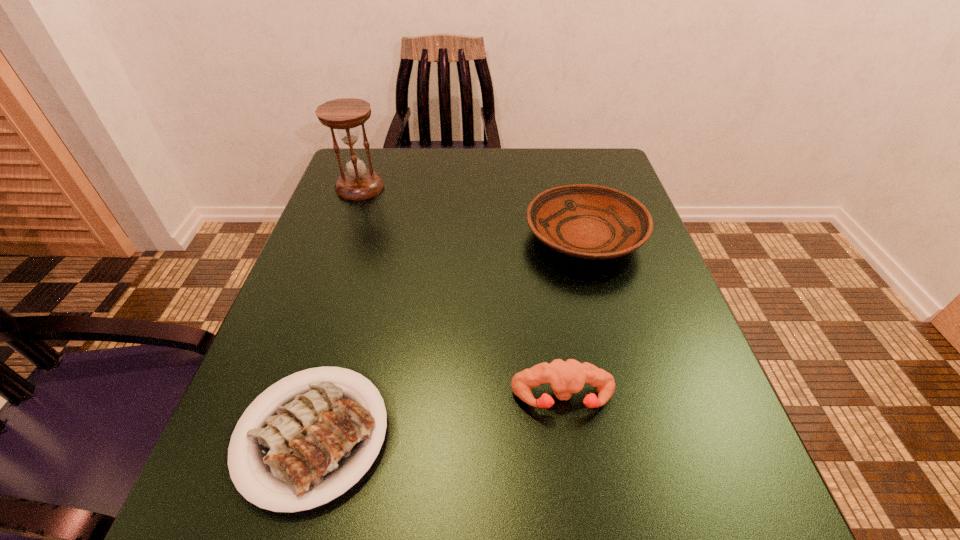
I want to click on free space between the taller plate and the puncher, so click(573, 318).

This screenshot has width=960, height=540. I want to click on empty space between the third nearest object and the puncher, so click(x=573, y=318).

Identify the location of free area in between the left plate and the puncher. This screenshot has width=960, height=540. tap(438, 417).

This screenshot has width=960, height=540. What are the coordinates of `free space that is in between the hourglass and the third nearest object` in the screenshot? It's located at (472, 212).

The image size is (960, 540). Find the location of `free space that is in between the nearer plate and the hourglass`. free space that is in between the nearer plate and the hourglass is located at coordinates (337, 311).

Locate which object is the closest to the nearer plate. Please provide its 2D coordinates. Your answer should be formatted as a tuple, i.e. [(x, y)], where the tuple contains the x and y coordinates of a point satisfying the conditions above.

[(566, 377)]

Choose which object is the third nearest neighbor to the puncher. Please provide its 2D coordinates. Your answer should be formatted as a tuple, i.e. [(x, y)], where the tuple contains the x and y coordinates of a point satisfying the conditions above.

[(345, 115)]

Identify the location of free space that satisfies the following two spatial constraints: 1. on the front side of the tallest object; 2. on the left side of the farther plate. This screenshot has width=960, height=540. (343, 237).

At what (x,y) coordinates should I click in order to perform the action: click on vacant space that satisfies the following two spatial constraints: 1. on the front side of the third nearest object; 2. on the right side of the farthest object. Please return your answer as a coordinate pair (x, y). Image resolution: width=960 pixels, height=540 pixels. Looking at the image, I should click on (343, 237).